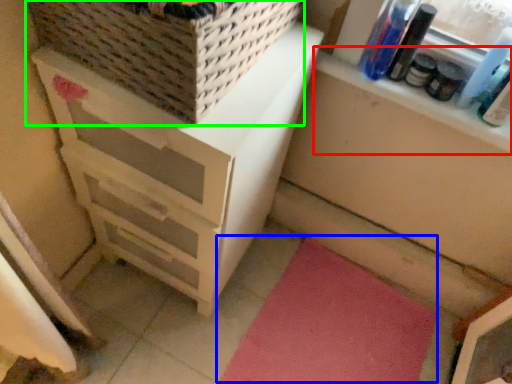
Question: Based on their relative distances, which object is nearer to window sill (highlighted by a red box)? Choose from yoga mat (highlighted by a blue box) and basket (highlighted by a green box).

Choices:
 (A) yoga mat
 (B) basket

Answer: (B)